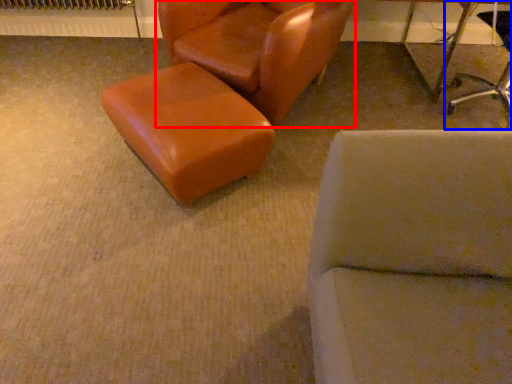
Question: Among these objects, which one is nearest to the camera, chair (highlighted by a red box) or chair (highlighted by a blue box)?

Choices:
 (A) chair
 (B) chair

Answer: (A)